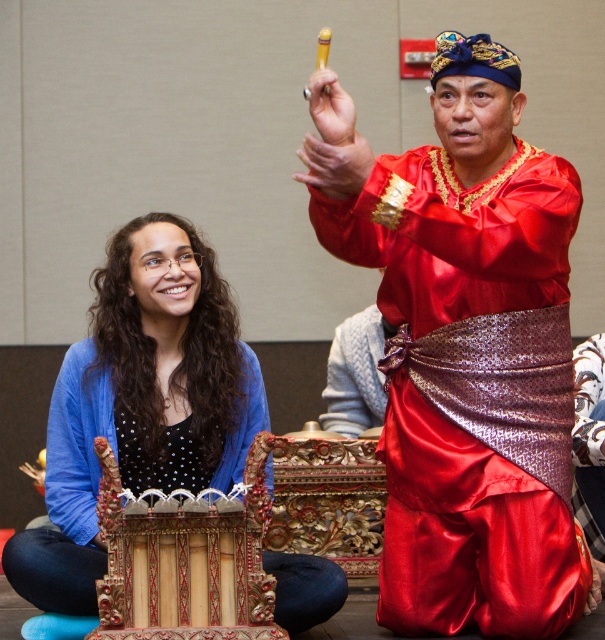
You are organizing a small cultural event and need to place a 1.8 meter long table between the shiny red fabric at center and the wooden instrument at lower left. Will the table fit in the space between them?

The distance between the shiny red fabric at center and the wooden instrument at lower left is 2.02 meters. Since the table is 1.8 meters long, it will fit with some space to spare.

You are a photographer standing at the camera position. You want to capture a closeup shot of the shiny red fabric at center. The camera has a minimum focusing distance of 2 meters. Can you take the photo without moving closer?

The shiny red fabric at center is 10.70 meters from the camera. Since the minimum focusing distance is 2 meters, the photographer can take the closeup shot without moving closer because the fabric is within the camera range.